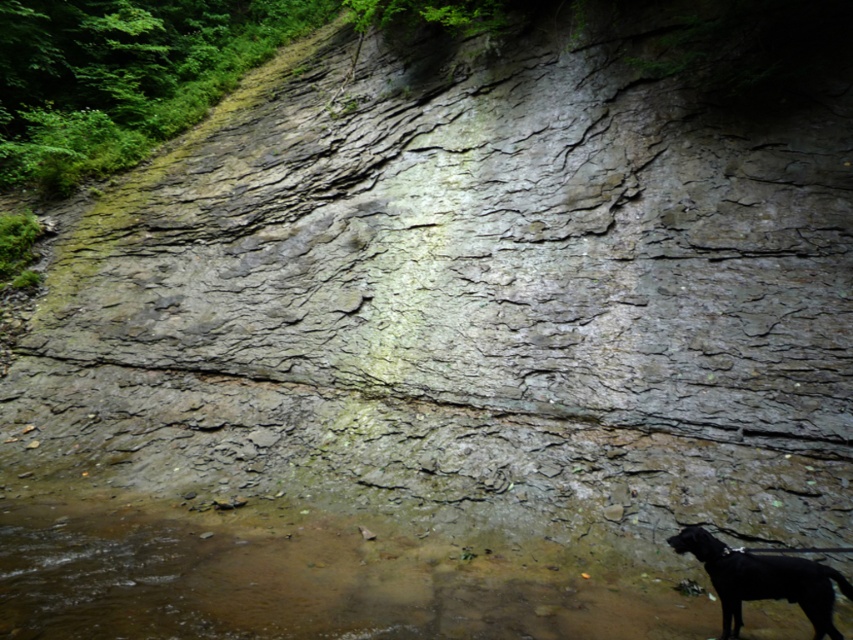
You are standing at the edge of the stream and want to cross it to reach the black matte dog at lower right. The brown matte water at lower center is reflecting sunlight. Can you step onto the water to cross?

The brown matte water at lower center is shorter than the black matte dog at lower right, but water cannot be stepped on regardless of its height. You need to find another way to cross the stream.

You are standing at the edge of the cliff looking down. You see the brown matte water at lower center and the black matte dog at lower right. Which object is bigger in size?

The brown matte water at lower center is larger in size compared to the black matte dog at lower right.

You are standing at the base of the cliff and looking towards the rock face. There are two points marked on the rock surface. The first point is at coordinates point (796, 628) and the second is at point (718, 566). Which of these two points is closer to you?

Point (718, 566) is closer to you because it is in front of point (796, 628).